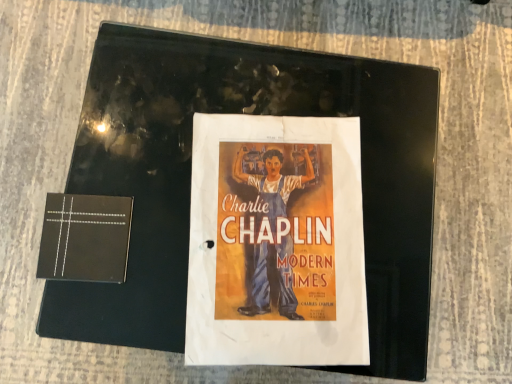
At what (x,y) coordinates should I click in order to perform the action: click on matte paper poster at center. Please return your answer as a coordinate pair (x, y). This screenshot has width=512, height=384. Looking at the image, I should click on pyautogui.click(x=190, y=179).

The height and width of the screenshot is (384, 512). What do you see at coordinates (190, 179) in the screenshot?
I see `matte paper poster at center` at bounding box center [190, 179].

Where is `black matte paper at left`? black matte paper at left is located at coordinates (85, 238).

What do you see at coordinates (85, 238) in the screenshot?
I see `black matte paper at left` at bounding box center [85, 238].

What is the approximate height of black matte paper at left?

It is 0.98 inches.

Locate an element on the screen. The width and height of the screenshot is (512, 384). matte paper poster at center is located at coordinates (190, 179).

Which object is positioned more to the left, matte paper poster at center or black matte paper at left?

black matte paper at left.

Relative to black matte paper at left, is matte paper poster at center in front or behind?

Visually, matte paper poster at center is located behind black matte paper at left.

Which is closer to the camera, (x=421, y=208) or (x=82, y=201)?

The point (x=82, y=201) is closer.

From the image's perspective, is matte paper poster at center above black matte paper at left?

Yes, from the image's perspective, matte paper poster at center is on top of black matte paper at left.

From a real-world perspective, relative to black matte paper at left, is matte paper poster at center vertically above or below?

matte paper poster at center is situated lower than black matte paper at left in the real world.

Between matte paper poster at center and black matte paper at left, which one has larger width?

With larger width is matte paper poster at center.

From their relative heights in the image, would you say matte paper poster at center is taller or shorter than black matte paper at left?

In the image, matte paper poster at center appears to be taller than black matte paper at left.

Based on their sizes in the image, would you say matte paper poster at center is bigger or smaller than black matte paper at left?

In the image, matte paper poster at center appears to be larger than black matte paper at left.

Would you say black matte paper at left is part of matte paper poster at center's contents?

That's incorrect, black matte paper at left is not inside matte paper poster at center.

Is matte paper poster at center far from black matte paper at left?

No, matte paper poster at center is in close proximity to black matte paper at left.

Is matte paper poster at center turned away from black matte paper at left?

No.

The width and height of the screenshot is (512, 384). Identify the location of magazine behind the black matte paper at left. (190, 179).

Looking at this image, which is more to the left, black matte paper at left or matte paper poster at center?

black matte paper at left.

Considering their positions, is black matte paper at left located in front of or behind matte paper poster at center?

Visually, black matte paper at left is located in front of matte paper poster at center.

Is point (57, 253) less distant than point (359, 115)?

Yes, it is in front of point (359, 115).

From the image's perspective, is black matte paper at left positioned above or below matte paper poster at center?

From the image's perspective, black matte paper at left appears below matte paper poster at center.

From a real-world perspective, is black matte paper at left under matte paper poster at center?

No, from a real-world perspective, black matte paper at left is not below matte paper poster at center.

Is black matte paper at left thinner than matte paper poster at center?

Yes, black matte paper at left is thinner than matte paper poster at center.

Is black matte paper at left taller or shorter than matte paper poster at center?

Clearly, black matte paper at left is shorter compared to matte paper poster at center.

Looking at this image, can you confirm if black matte paper at left is bigger than matte paper poster at center?

Actually, black matte paper at left might be smaller than matte paper poster at center.

Is matte paper poster at center inside black matte paper at left?

No, matte paper poster at center is located outside of black matte paper at left.

Is black matte paper at left next to matte paper poster at center?

No, black matte paper at left is not next to matte paper poster at center.

Does black matte paper at left turn towards matte paper poster at center?

No, black matte paper at left is not oriented towards matte paper poster at center.

What's the angular difference between black matte paper at left and matte paper poster at center's facing directions?

The angle between the facing direction of black matte paper at left and the facing direction of matte paper poster at center is 10 degrees.

At what (x,y) coordinates should I click in order to perform the action: click on paperback book that appears on the left of matte paper poster at center. Please return your answer as a coordinate pair (x, y). The width and height of the screenshot is (512, 384). Looking at the image, I should click on click(85, 238).

Locate an element on the screen. magazine below the black matte paper at left (from a real-world perspective) is located at coordinates (190, 179).

I want to click on paperback book on the left of the matte paper poster at center, so click(x=85, y=238).